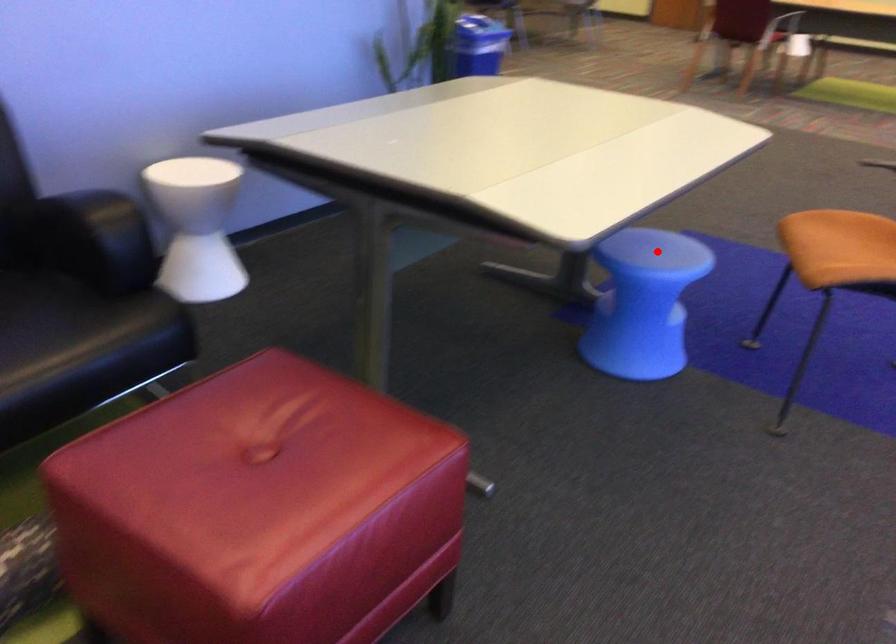
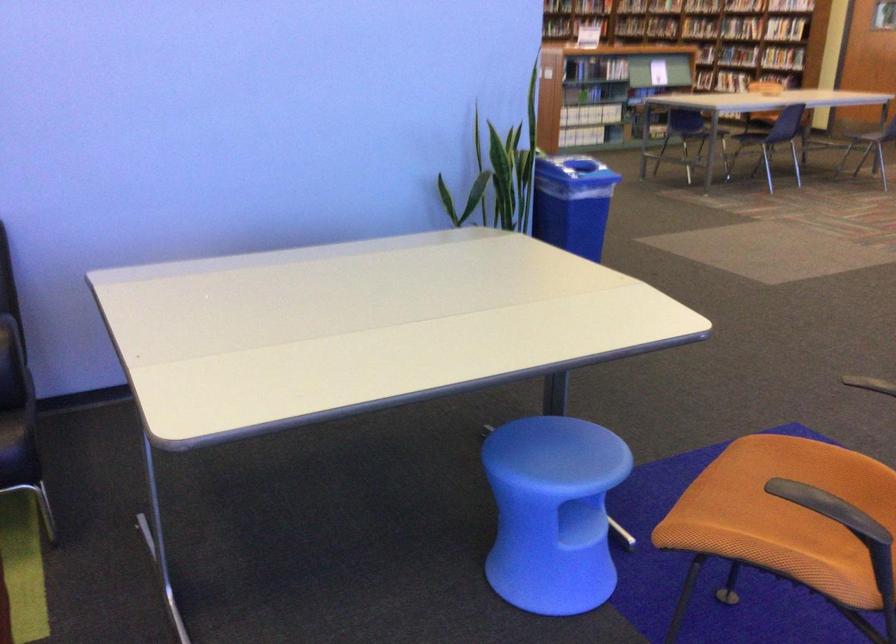
In the second image, find the point that corresponds to the highlighted location in the first image.

(560, 453)